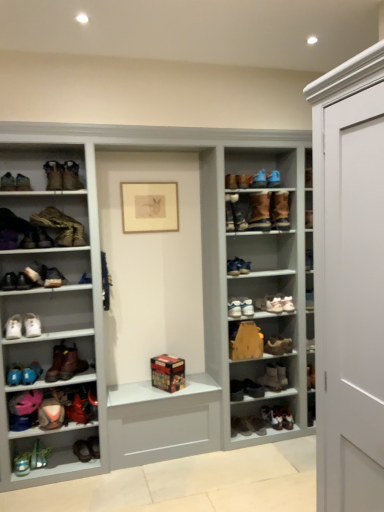
This screenshot has width=384, height=512. I want to click on free space in front of leather boot at lower center, the ninth shoe viewed from the top, so click(251, 441).